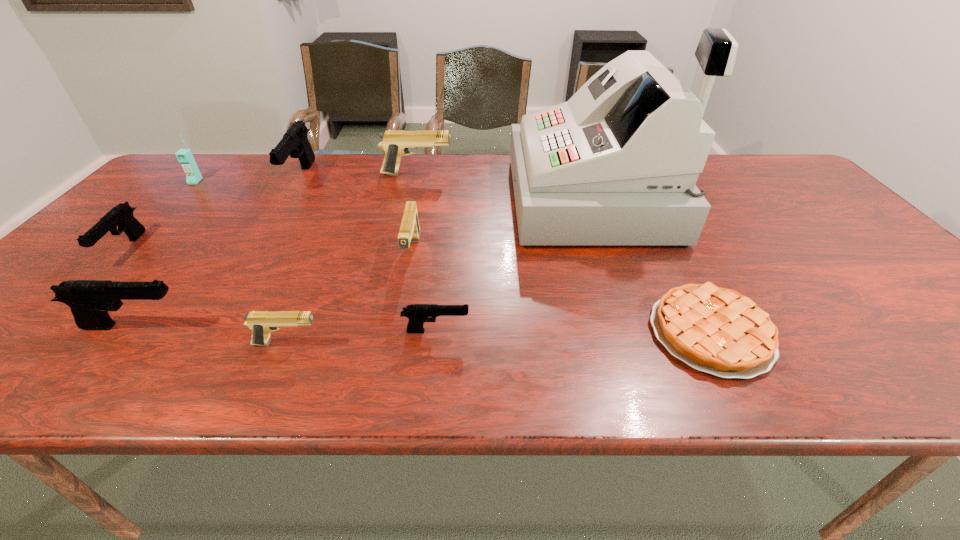
What are the coordinates of `the leftmost pistol` in the screenshot? It's located at (121, 215).

Image resolution: width=960 pixels, height=540 pixels. What are the coordinates of `the fifth object from left to right` in the screenshot? It's located at (261, 323).

The height and width of the screenshot is (540, 960). Identify the location of the fourth pistol from right to left. (261, 323).

You are a GUI agent. You are given a task and a screenshot of the screen. Output one action in this format:
    pyautogui.click(x=<x>, y=<y>)
    Task: Click on the smallest black pistol
    The image size is (960, 540).
    Given the screenshot: What is the action you would take?
    pyautogui.click(x=418, y=314)

This screenshot has width=960, height=540. Find the location of `pie`. pie is located at coordinates (719, 331).

Locate an element on the screen. The image size is (960, 540). free space located 0.230m on the keypad side of the gray cash register is located at coordinates (435, 200).

This screenshot has height=540, width=960. I want to click on free space located on the keypad side of the gray cash register, so click(490, 200).

At what (x,y) coordinates should I click in order to perform the action: click on vacant space located on the keypad side of the gray cash register. Please return your answer as a coordinate pair (x, y). This screenshot has width=960, height=540. Looking at the image, I should click on (428, 200).

This screenshot has height=540, width=960. Find the location of `free space located on the front-facing side of the third black pistol from left to right`. free space located on the front-facing side of the third black pistol from left to right is located at coordinates (267, 231).

Identify the location of free space located 0.170m on the keypad of the cellular telephone. (162, 215).